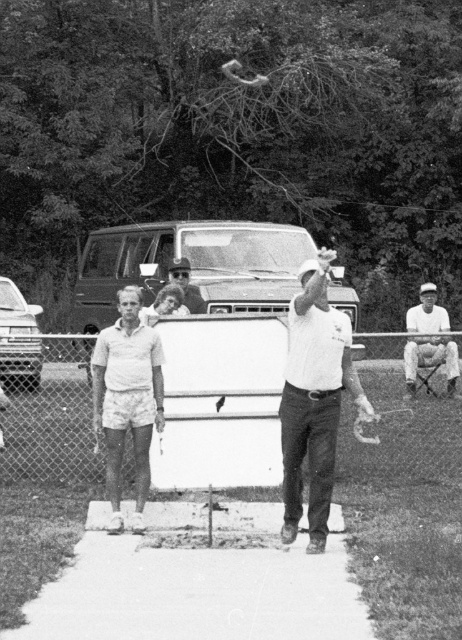
Question: Where is chain-link fence at lower center located in relation to smooth plastic sunglasses at center in the image?

Choices:
 (A) left
 (B) right

Answer: (B)

Question: From the image, what is the correct spatial relationship of white cotton shorts at center in relation to white fabric shirt at right?

Choices:
 (A) left
 (B) right

Answer: (A)

Question: Does white matte shirt at center come in front of white cotton shorts at center?

Choices:
 (A) yes
 (B) no

Answer: (A)

Question: Based on their relative distances, which object is nearer to the chain-link fence at lower center?

Choices:
 (A) white matte shirt at center
 (B) white fabric shirt at right

Answer: (A)

Question: Which object appears farthest from the camera in this image?

Choices:
 (A) smooth plastic sunglasses at center
 (B) white cotton shorts at center
 (C) white matte shirt at center

Answer: (A)

Question: Estimate the real-world distances between objects in this image. Which object is farther from the chain-link fence at lower center?

Choices:
 (A) white fabric shirt at right
 (B) white matte shirt at center
 (C) white cotton shorts at center

Answer: (A)